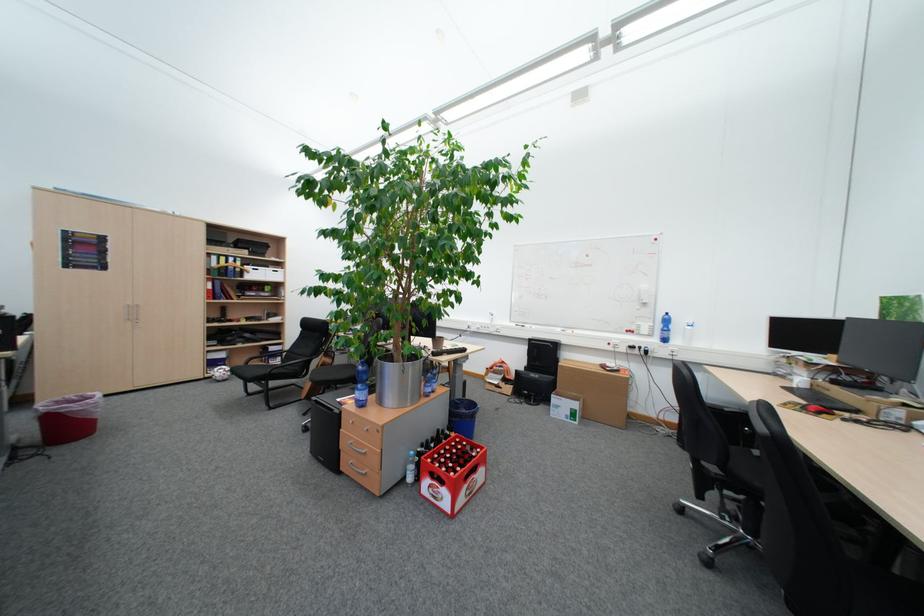
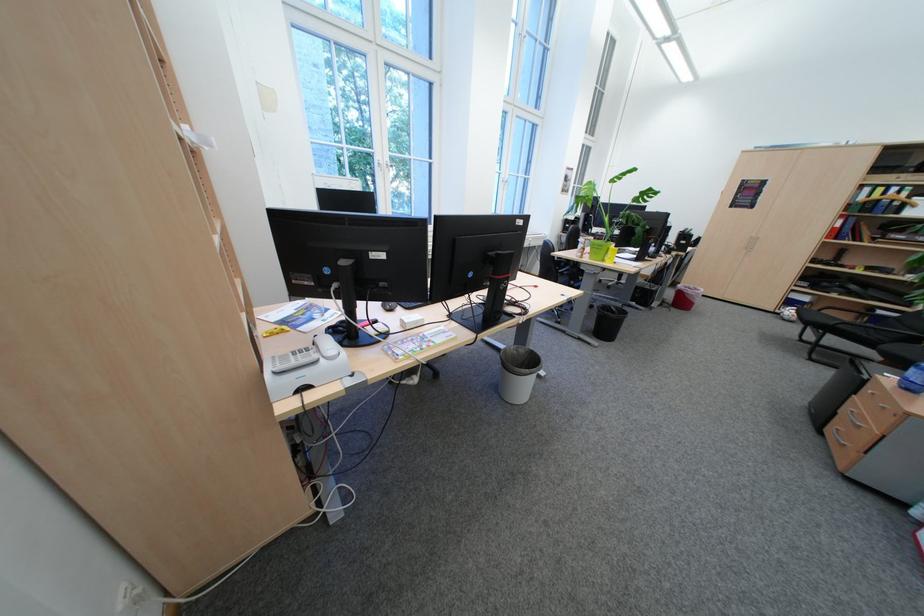
Locate, in the second image, the point that corresponds to point 276,349 in the first image.

(881, 310)